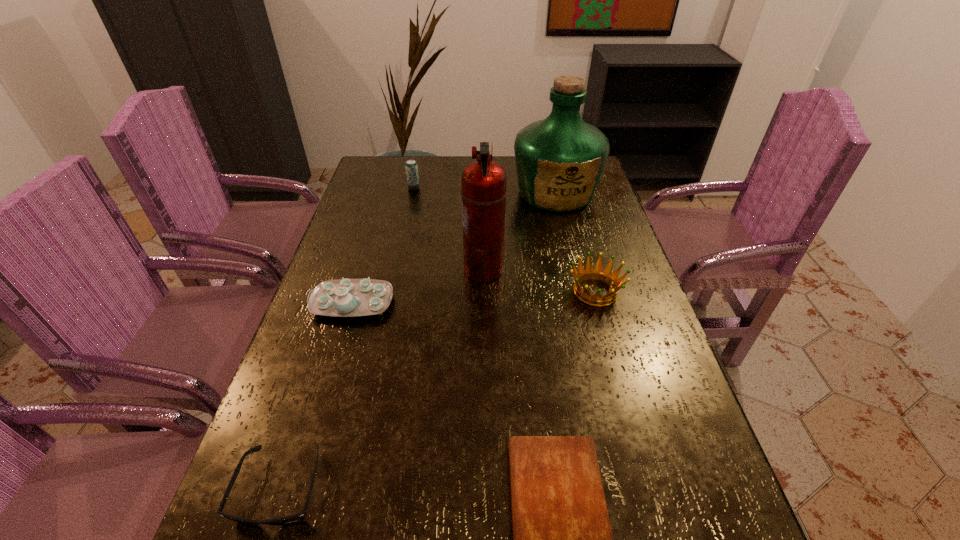
At what (x,y) coordinates should I click in order to perform the action: click on fire extinguisher. Please return your answer as a coordinate pair (x, y). The height and width of the screenshot is (540, 960). Looking at the image, I should click on (483, 182).

You are a GUI agent. You are given a task and a screenshot of the screen. Output one action in this format:
    pyautogui.click(x=<x>, y=<y>)
    Task: Click on the liquor
    The height and width of the screenshot is (540, 960).
    Given the screenshot: What is the action you would take?
    pyautogui.click(x=559, y=160)

Identify the location of beer can. This screenshot has height=540, width=960. (411, 167).

This screenshot has width=960, height=540. Identify the location of chinaware. (345, 297).

Locate an element on the screen. crown is located at coordinates (597, 273).

This screenshot has height=540, width=960. I want to click on the second shortest object, so tap(298, 517).

Where is `vacant space located on the side of the fire extinguisher with the handle and hose`? vacant space located on the side of the fire extinguisher with the handle and hose is located at coordinates (337, 269).

Find the location of a particular element. This screenshot has height=540, width=960. free space located on the side of the fire extinguisher with the handle and hose is located at coordinates (442, 269).

Image resolution: width=960 pixels, height=540 pixels. I want to click on free space located on the side of the fire extinguisher with the handle and hose, so click(x=434, y=269).

The height and width of the screenshot is (540, 960). What are the coordinates of `vacant space situated 0.350m on the label side of the liquor` in the screenshot? It's located at (581, 296).